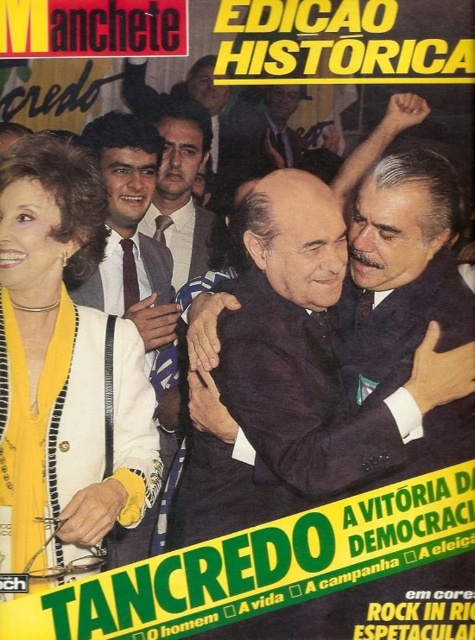
Based on the photo, who is more distant from viewer, (342, 330) or (154, 337)?

Positioned behind is point (154, 337).

From the picture: Which is above, dark suit at center or dark brown tie at left?

dark brown tie at left is higher up.

Image resolution: width=475 pixels, height=640 pixels. I want to click on dark suit at center, so click(x=333, y=364).

Is point (12, 422) positioned behind point (162, 230)?

No, it is not.

Which of these two, yellow fabric at left or matte black suit at center, stands taller?

yellow fabric at left

This screenshot has height=640, width=475. In order to click on yellow fabric at left in this screenshot , I will do `click(63, 372)`.

Image resolution: width=475 pixels, height=640 pixels. Find the location of `yellow fabric at left`. yellow fabric at left is located at coordinates (63, 372).

Who is shorter, yellow fabric at left or dark brown tie at left?

dark brown tie at left

Does yellow fabric at left have a greater width compared to dark brown tie at left?

Yes, yellow fabric at left is wider than dark brown tie at left.

Who is more distant from viewer, [54,532] or [117,301]?

Point [117,301]

Where is `yellow fabric at left`? This screenshot has height=640, width=475. yellow fabric at left is located at coordinates (63, 372).